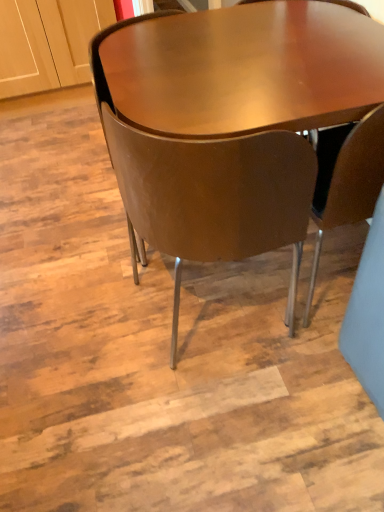
Locate an element on the screen. This screenshot has height=512, width=384. free space above matte brown chair at center, which ranks as the 3th chair in left-to-right order (from a real-world perspective) is located at coordinates (350, 64).